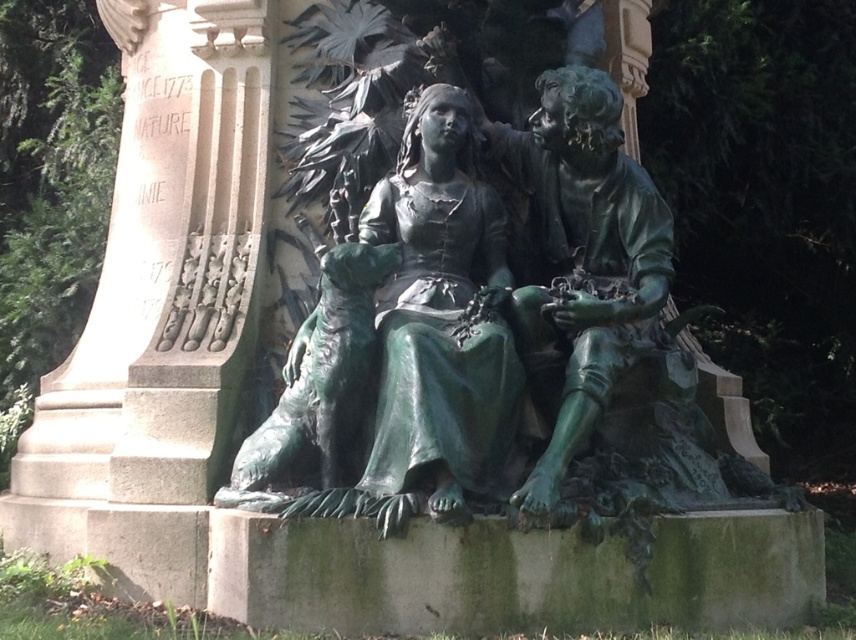
From the picture: You are standing in a park and see the green patina statue at center. If you want to take a photo of it with your phone, which is 15 meters away from you, will you be able to capture the entire statue in the frame?

The green patina statue at center is 22.97 meters away from the viewer, which is farther than 15 meters. Therefore, you will not be able to capture the entire statue in the frame with your phone at that distance.

You are an art curator planning to move the green patina statue at center and the green patina statue at right into a new exhibition space. The new space has limited floor area. Which statue should you prioritize moving first to ensure it fits within the available space?

The green patina statue at center occupies less space than the green patina statue at right, so you should prioritize moving the green patina statue at right first to ensure it fits within the available space.

Looking at this image, you are an art conservator assessing the spacing between two green patina statues in a park. The statues are labeled as the green patina statue at center and the green patina statue at right. If the distance between them is exactly 2 meters, can a 1.8 meter wide conservation blanket cover both statues simultaneously without moving them?

The green patina statue at center has a lesser width compared to the green patina statue at right. Since the total width of both statues combined would exceed 1.8 meters, the conservation blanket cannot cover both simultaneously without moving them.